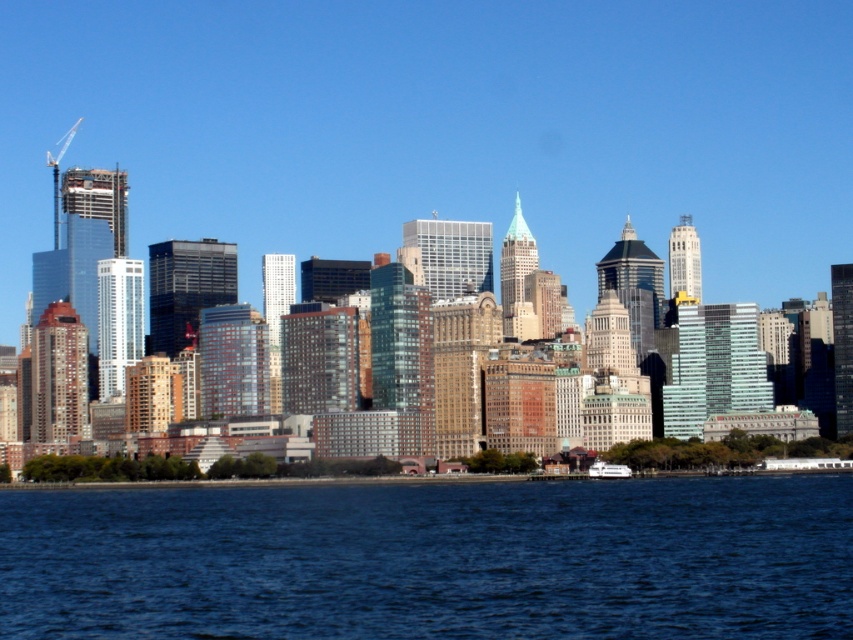
Does blue liquid water at lower center have a greater height compared to white glossy ferry at lower center?

Yes.

Does blue liquid water at lower center have a smaller size compared to white glossy ferry at lower center?

Incorrect, blue liquid water at lower center is not smaller in size than white glossy ferry at lower center.

Which is behind, point (814, 513) or point (612, 467)?

The point (612, 467) is behind.

Identify the location of blue liquid water at lower center. This screenshot has width=853, height=640. [432, 560].